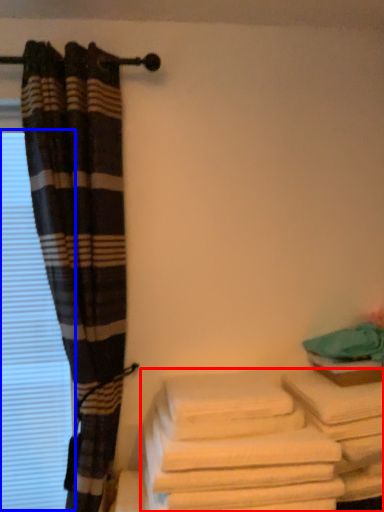
Question: Which object appears farthest to the camera in this image, towel (highlighted by a red box) or window (highlighted by a blue box)?

Choices:
 (A) towel
 (B) window

Answer: (B)